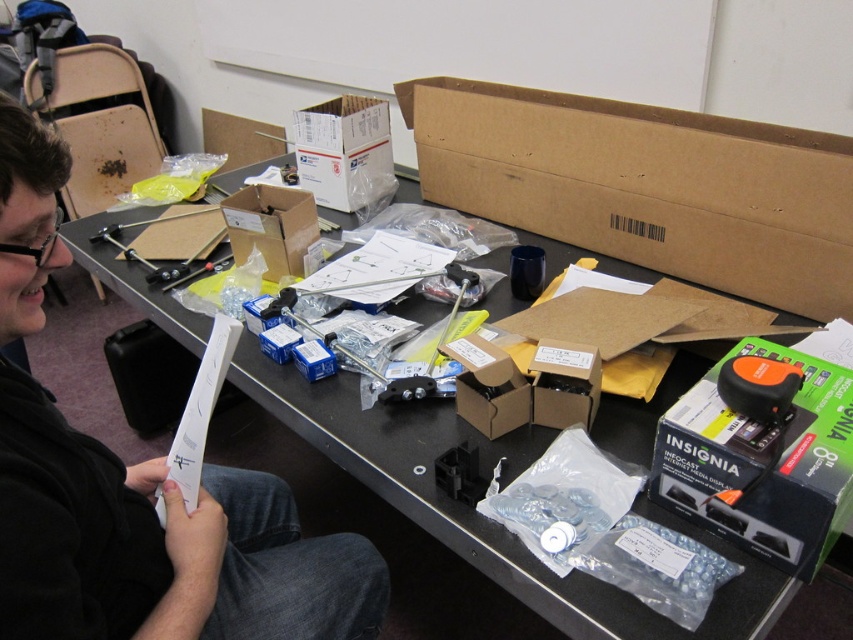
Question: Which point is farther to the camera?

Choices:
 (A) (18, 500)
 (B) (788, 362)
 (C) (630, 212)
 (D) (251, 234)

Answer: (D)

Question: Can you confirm if black plastic box at lower right is positioned to the left of matte cardboard box at center?

Choices:
 (A) no
 (B) yes

Answer: (A)

Question: Which of the following is the farthest from the observer?

Choices:
 (A) black paper at left
 (B) brown cardboard box at center
 (C) black cardboard table at center

Answer: (B)

Question: Does brown cardboard box at upper right have a larger size compared to matte cardboard box at center?

Choices:
 (A) no
 (B) yes

Answer: (B)

Question: Which of the following is the closest to the observer?

Choices:
 (A) (793, 417)
 (B) (608, 227)

Answer: (A)

Question: From the image, what is the correct spatial relationship of black cardboard table at center in relation to brown cardboard box at center?

Choices:
 (A) below
 (B) above

Answer: (B)